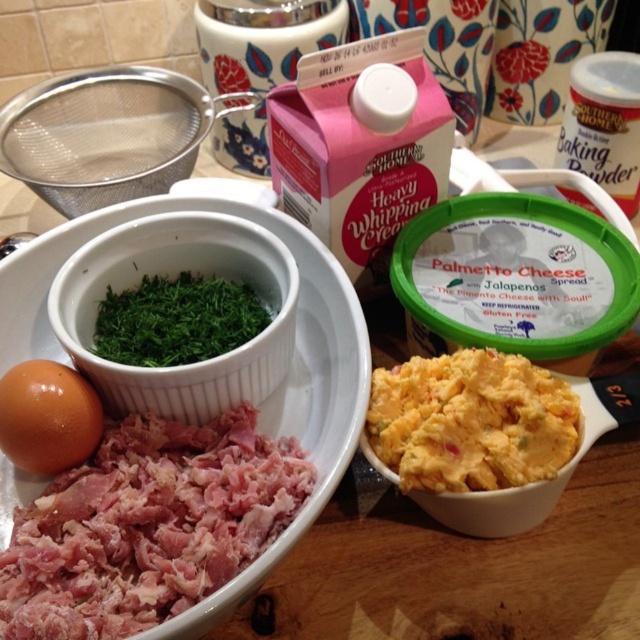
Can you confirm if pinkish raw meat at lower left is taller than yellowish-orange creamy spread at center-right?

Yes, pinkish raw meat at lower left is taller than yellowish-orange creamy spread at center-right.

Between pinkish raw meat at lower left and yellowish-orange creamy spread at center-right, which one is positioned lower?

Positioned lower is pinkish raw meat at lower left.

This screenshot has width=640, height=640. Identify the location of pinkish raw meat at lower left. (147, 525).

Is pinkish raw meat at lower left taller than green leafymaterial/textureparsley at center?

Yes.

Who is higher up, pinkish raw meat at lower left or green leafymaterial/textureparsley at center?

green leafymaterial/textureparsley at center

Identify the location of pinkish raw meat at lower left. (147, 525).

Which is below, green leafy herb at lower left or brown matte egg at lower left?

Positioned lower is brown matte egg at lower left.

Is the position of green leafy herb at lower left less distant than that of brown matte egg at lower left?

No, green leafy herb at lower left is further to the viewer.

Does point (294, 308) lie in front of point (12, 394)?

No, (294, 308) is further to viewer.

Locate an element on the screen. Image resolution: width=640 pixels, height=640 pixels. green leafy herb at lower left is located at coordinates pos(173,276).